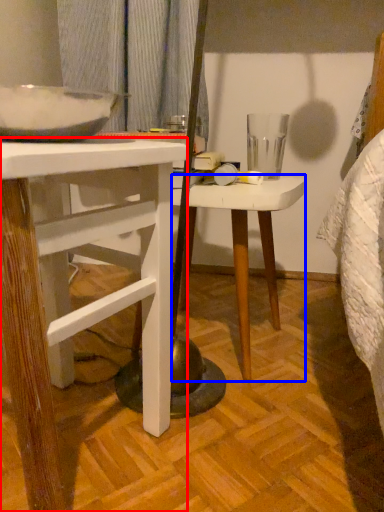
Question: Which point is closer to the camera, desk (highlighted by a red box) or stool (highlighted by a blue box)?

Choices:
 (A) desk
 (B) stool

Answer: (A)